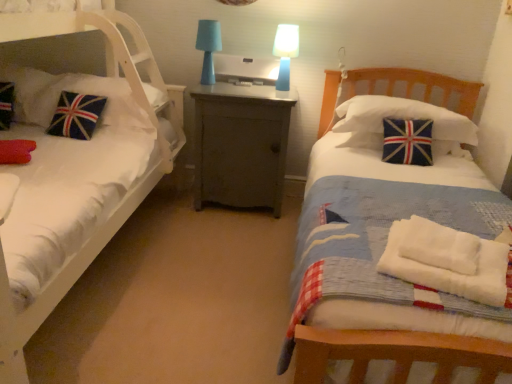
The width and height of the screenshot is (512, 384). What are the coordinates of `vacant area on top of white cotton towels at lower right (from a real-world perspective)` in the screenshot? It's located at (442, 247).